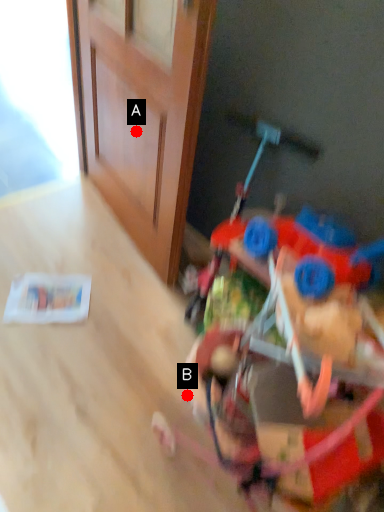
Question: Two points are circled on the image, labeled by A and B beside each circle. Which point appears closest to the camera in this image?

Choices:
 (A) A is closer
 (B) B is closer

Answer: (B)